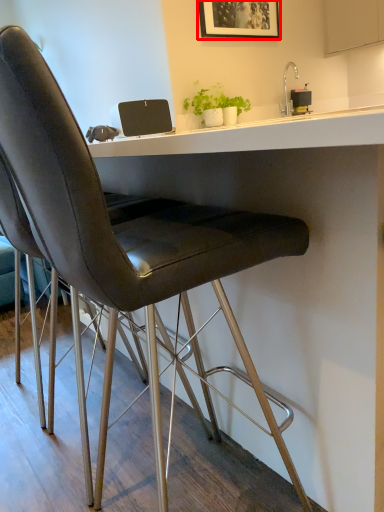
Question: From the image's perspective, where is picture frame (annotated by the red box) located relative to cabinetry?

Choices:
 (A) above
 (B) below

Answer: (B)